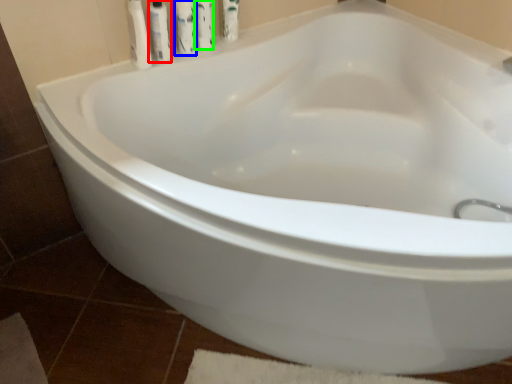
Question: Which object is positioned farthest from toiletry (highlighted by a red box)? Select from cleaning product (highlighted by a blue box) and cleaning product (highlighted by a green box).

Choices:
 (A) cleaning product
 (B) cleaning product

Answer: (B)